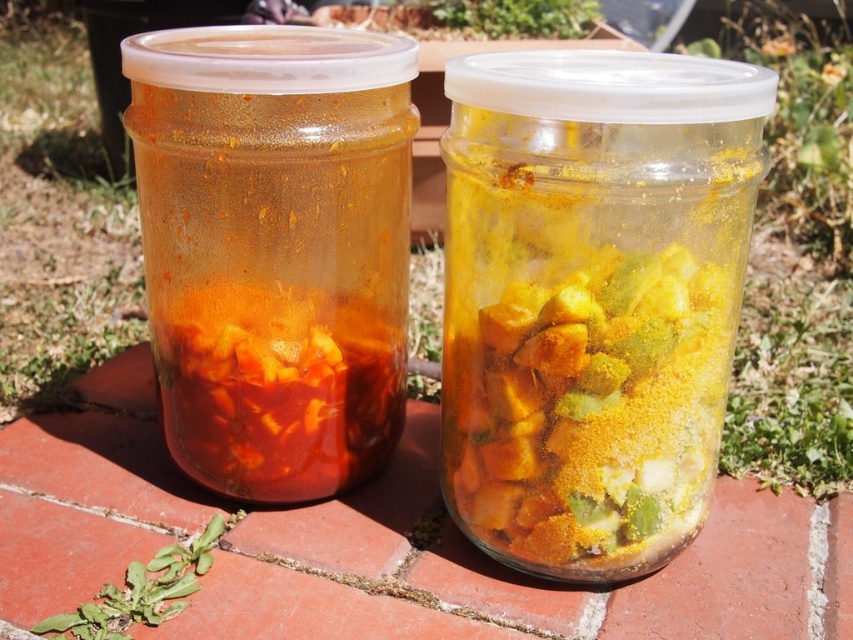
Question: Which object is closer to the camera taking this photo?

Choices:
 (A) yellow translucent jar at center
 (B) translucent glass jar at left

Answer: (A)

Question: Among these points, which one is nearest to the camera?

Choices:
 (A) (368, 93)
 (B) (492, 371)

Answer: (B)

Question: Can you confirm if yellow translucent jar at center is positioned to the right of translucent glass jar at left?

Choices:
 (A) yes
 (B) no

Answer: (A)

Question: Among these objects, which one is farthest from the camera?

Choices:
 (A) translucent glass jar at left
 (B) yellow translucent jar at center

Answer: (A)

Question: Can you confirm if yellow translucent jar at center is smaller than translucent glass jar at left?

Choices:
 (A) no
 (B) yes

Answer: (B)

Question: Does yellow translucent jar at center have a lesser width compared to translucent glass jar at left?

Choices:
 (A) yes
 (B) no

Answer: (A)